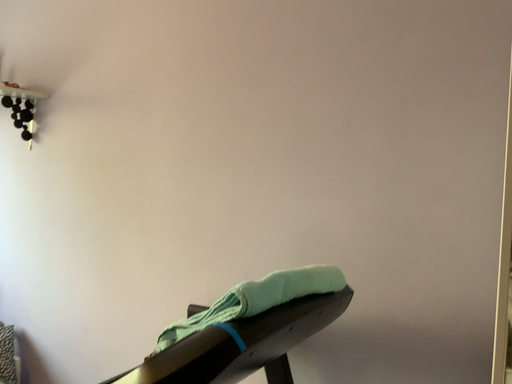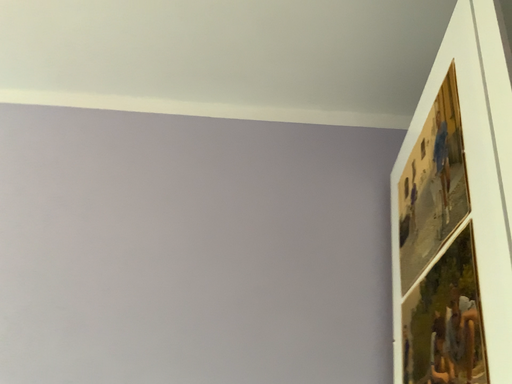
Question: Which way did the camera rotate in the video?

Choices:
 (A) rotated left
 (B) rotated right

Answer: (B)